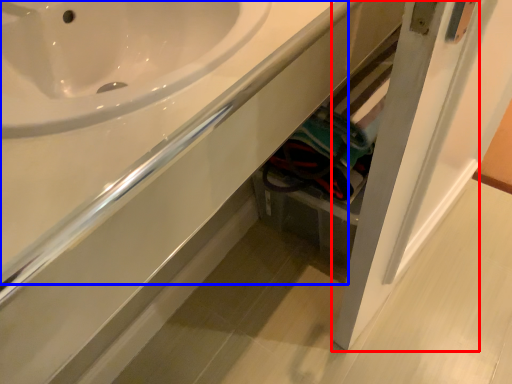
Question: Which object is further to the camera taking this photo, door (highlighted by a red box) or counter top (highlighted by a blue box)?

Choices:
 (A) door
 (B) counter top

Answer: (A)